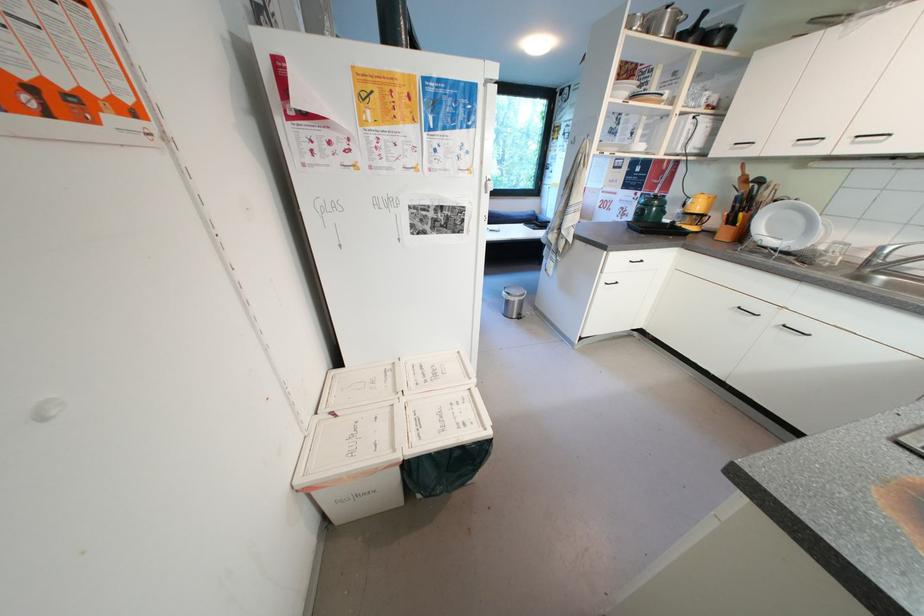
What do you see at coordinates (897, 261) in the screenshot? I see `a faucet handle` at bounding box center [897, 261].